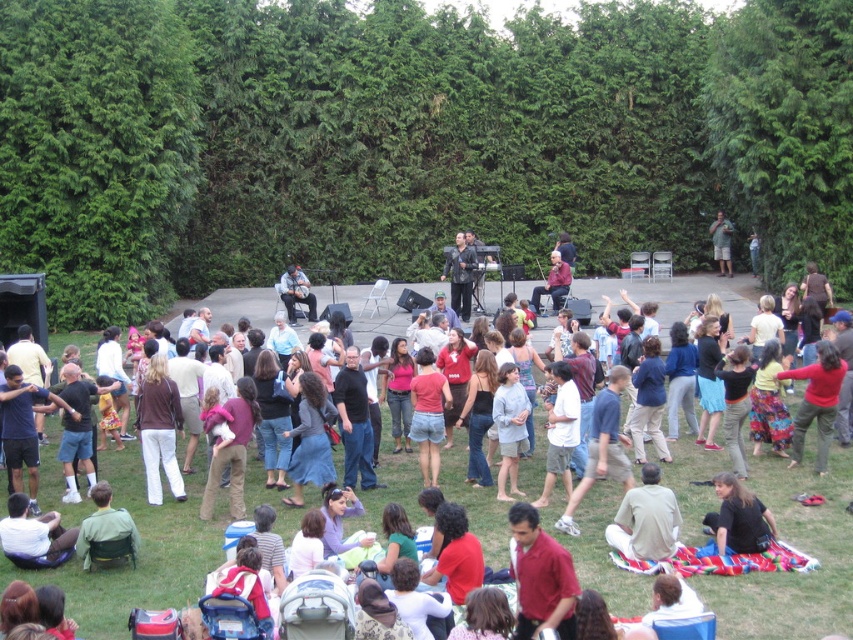
Question: Is matte red shirt at center bigger than matte black guitar at center?

Choices:
 (A) no
 (B) yes

Answer: (B)

Question: Which object is the closest to the green fabric jacket at lower left?

Choices:
 (A) green fabric shirt at center
 (B) light beige shirt at lower center

Answer: (B)

Question: Which of the following is the closest to the observer?

Choices:
 (A) (677, 513)
 (B) (554, 572)
 (C) (735, 528)

Answer: (B)

Question: Among these points, which one is nearest to the camera?

Choices:
 (A) (280, 298)
 (B) (572, 593)

Answer: (B)

Question: From the image, what is the correct spatial relationship of matte red shirt at center in relation to matte black guitar at center?

Choices:
 (A) left
 (B) right

Answer: (B)

Question: Is matte red shirt at center bigger than light beige shirt at lower center?

Choices:
 (A) no
 (B) yes

Answer: (B)